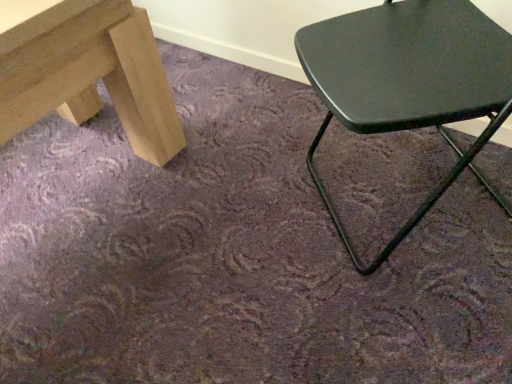
Locate an element on the screen. vacant area situated below metallic green chair at right (from a real-world perspective) is located at coordinates (388, 197).